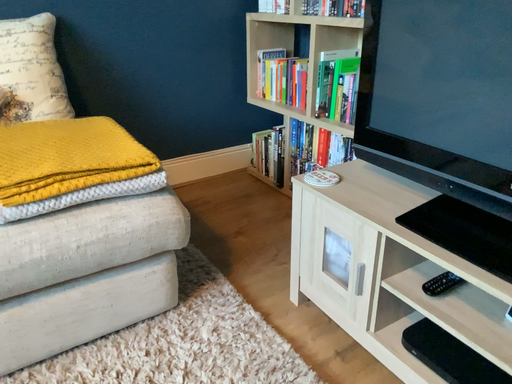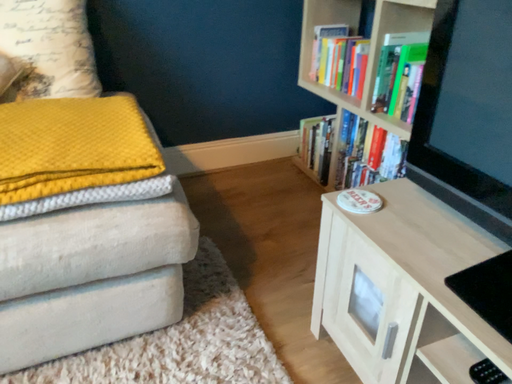
Question: Which way did the camera rotate in the video?

Choices:
 (A) rotated left
 (B) rotated right

Answer: (A)